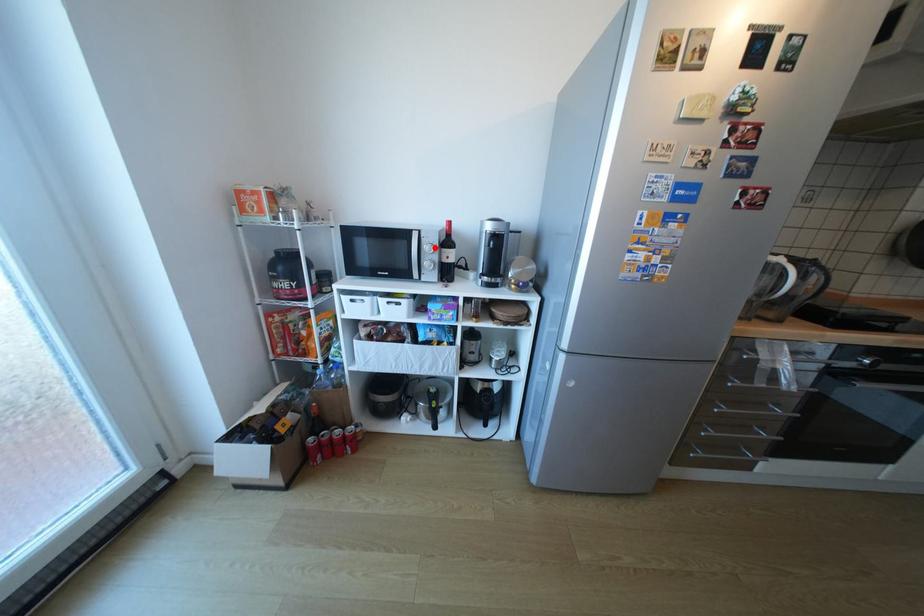
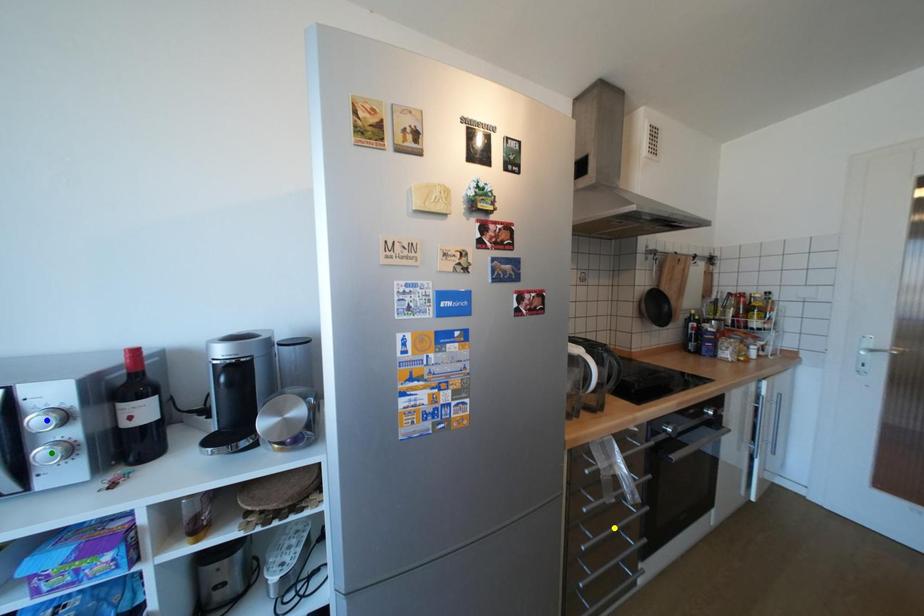
Question: I am providing you with two images of the same scene from different viewpoints. A red point is marked on the first image. You are given multiple points on the second image. Which mark in image 2 goes with the point in image 1?

Choices:
 (A) yellow point
 (B) green point
 (C) blue point

Answer: (C)